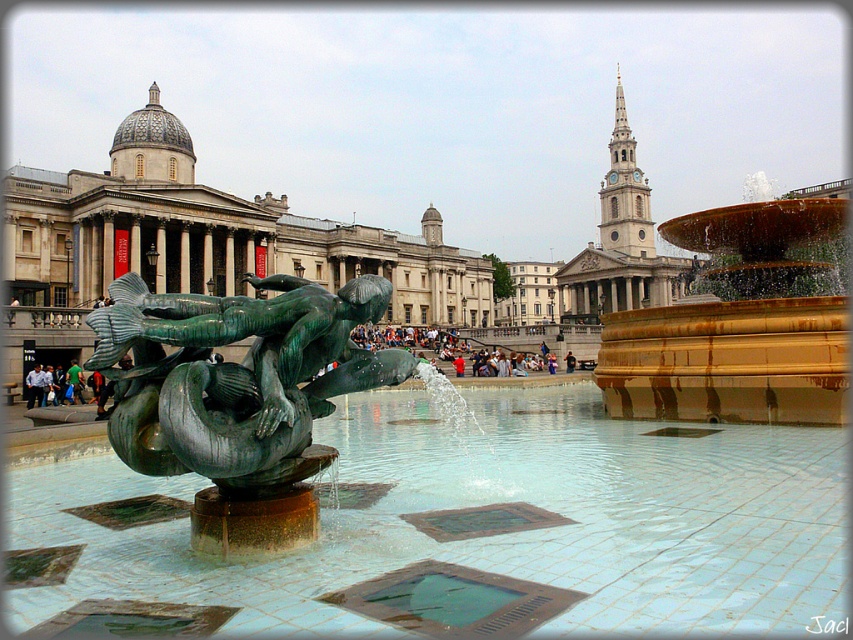
You are a tourist in Trafalgar Square and want to take a photo of both the clear water at fountain center and the gold metallic fountain at center. Which object should you position to the right side in your camera frame?

You should position the gold metallic fountain at center to the right side in your camera frame because the clear water at fountain center is on its left side.

You are a drone operator tasked with capturing aerial footage of the fountain in Trafalgar Square. The clear water at fountain center and the gold metallic fountain at center are both important subjects. Your drone has a camera with a maximum zoom range that can focus on objects within a 10 meter distance. Can your drone capture both subjects in a single shot without moving the camera?

The distance between the clear water at fountain center and the gold metallic fountain at center is 15.79 meters, which exceeds the 10 meter maximum zoom range. Therefore, the drone cannot capture both subjects in a single shot without moving the camera.

You are standing in Trafalgar Square and see the bronze textured sculpture at center and the green patina stone at center. Which object is positioned to the right of the other?

The bronze textured sculpture at center is to the right of the green patina stone at center.